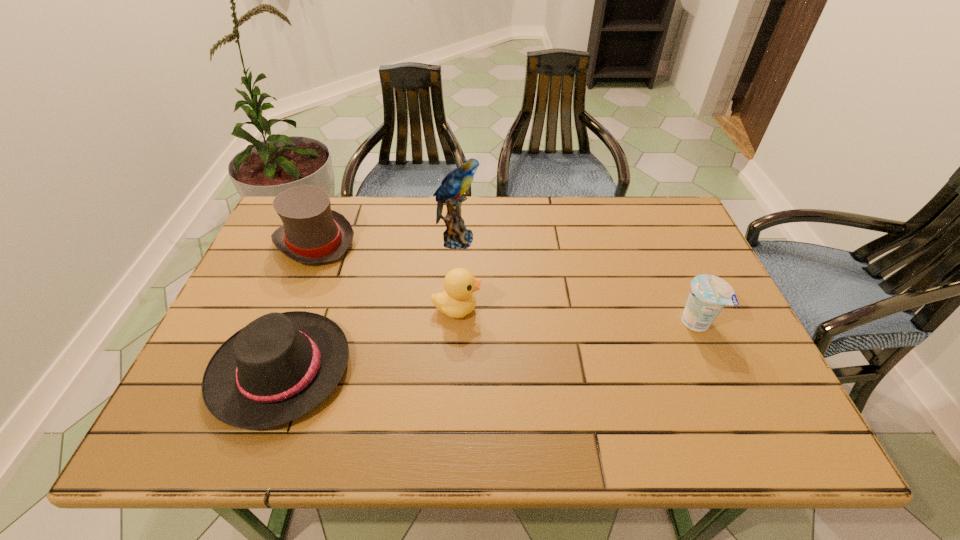
The height and width of the screenshot is (540, 960). I want to click on parrot present at the far edge, so click(456, 236).

Image resolution: width=960 pixels, height=540 pixels. In order to click on dress hat at the far edge in this screenshot , I will do `click(312, 233)`.

This screenshot has height=540, width=960. Identify the location of object present at the near edge. (280, 366).

You are a GUI agent. You are given a task and a screenshot of the screen. Output one action in this format:
    pyautogui.click(x=<x>, y=<y>)
    Task: Click on the object that is positioned at the right edge
    The image size is (960, 540).
    Given the screenshot: What is the action you would take?
    tap(709, 294)

I want to click on object that is at the far left corner, so click(312, 233).

Identify the location of object that is at the near left corner. click(x=280, y=366).

At what (x,y) coordinates should I click in order to perform the action: click on blank space at the far edge of the desktop. Please return your answer as a coordinate pair (x, y). The image size is (960, 540). Looking at the image, I should click on (507, 233).

This screenshot has width=960, height=540. Find the location of `free location at the near edge`. free location at the near edge is located at coordinates (676, 416).

I want to click on free space at the left edge, so click(x=297, y=296).

I want to click on free spot at the right edge of the desktop, so click(758, 390).